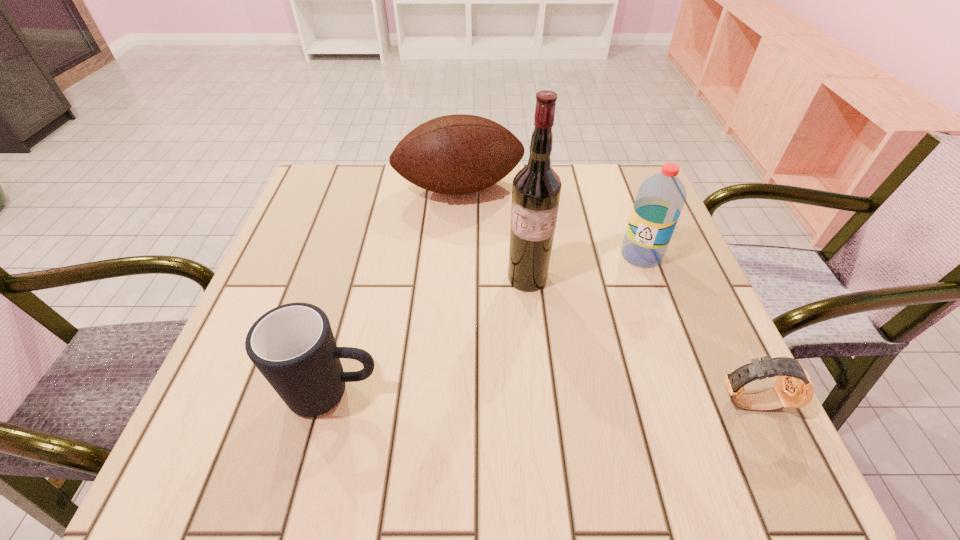
The width and height of the screenshot is (960, 540). Identify the location of vacant area that satisfies the following two spatial constraints: 1. on the front side of the football; 2. on the left side of the water bottle. (456, 255).